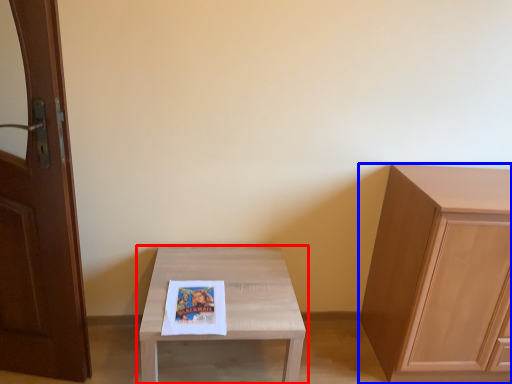
Question: Which object is further to the camera taking this photo, table (highlighted by a red box) or cabinetry (highlighted by a blue box)?

Choices:
 (A) table
 (B) cabinetry

Answer: (B)